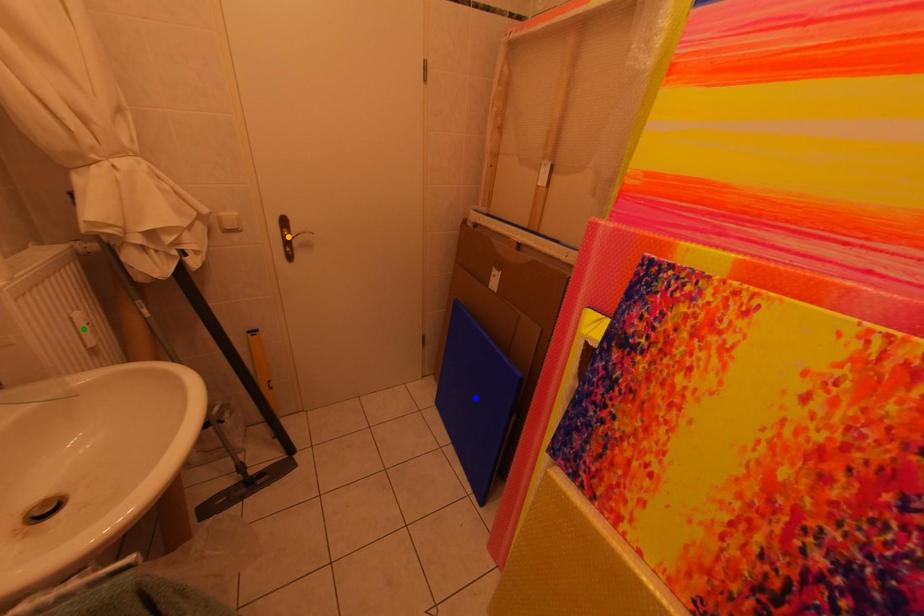
Order these from nearest to farthest:
1. green point
2. orange point
3. blue point

green point → orange point → blue point